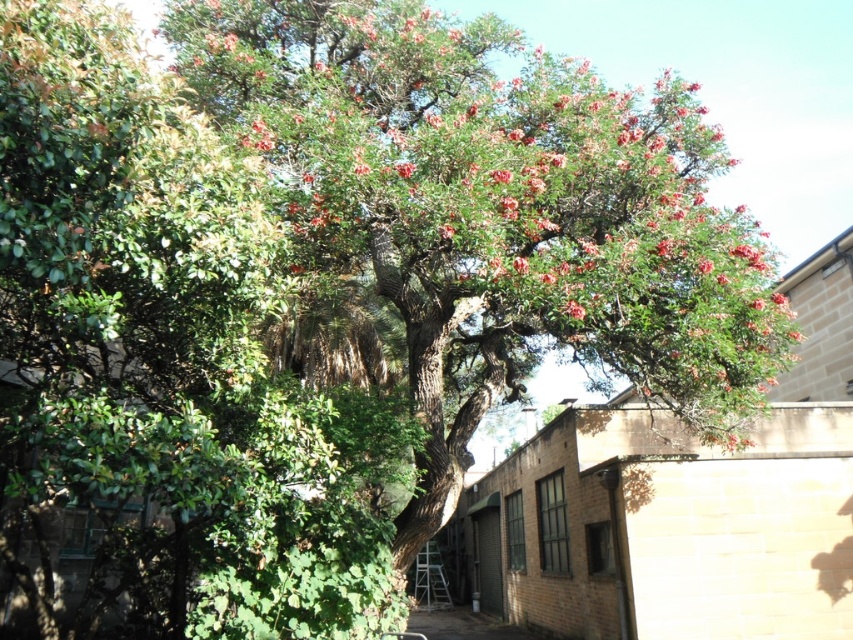
You are a landscape architect designing a garden path that needs to pass between the green leafy tree at upper left and the green leafy tree at center. Considering their sizes, which tree will require more space in the garden layout?

The green leafy tree at upper left requires more space in the garden layout because it has a larger size compared to the green leafy tree at center.

You are standing in front of the tree and want to determine which of the two points, point [154,456] or point [370,214], is nearer to you. Based on the scene description, which point is closer?

Point [154,456] is closer to the viewer than point [370,214].

You are standing at the center of the image. Which direction should you face to look directly at the green leafy tree at upper left?

You should face north to look directly at the green leafy tree at upper left.